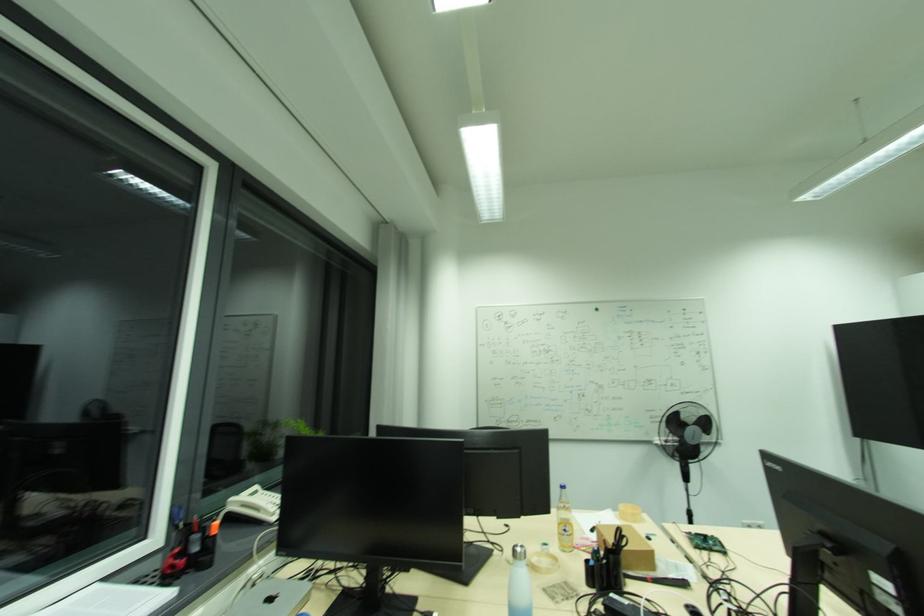
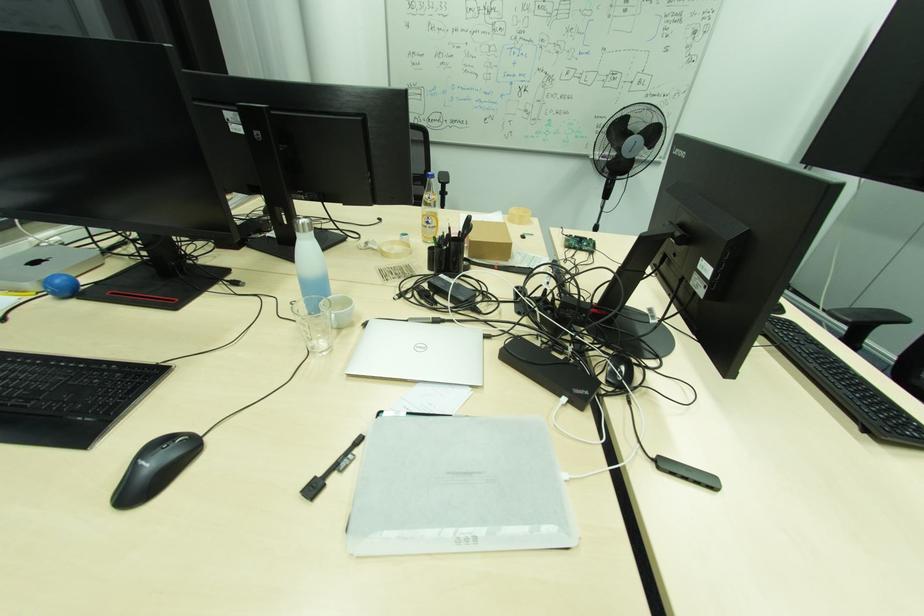
Question: How did the camera likely rotate?

Choices:
 (A) Left
 (B) Right
 (C) Up
 (D) Down

Answer: (D)